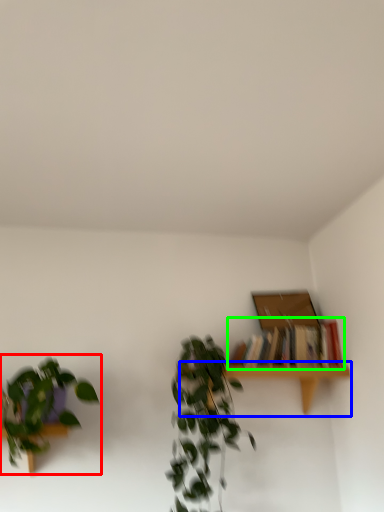
Question: Which object is positioned closest to houseplant (highlighted by a red box)? Select from table (highlighted by a blue box) and book (highlighted by a green box).

Choices:
 (A) table
 (B) book

Answer: (A)